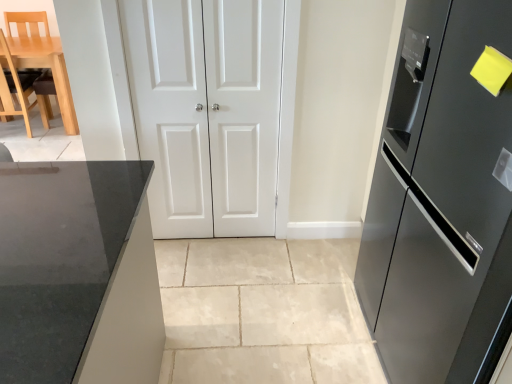
Question: Which direction should I rotate to look at white glossy door at center, which is counted as the 2th door, starting from the right, — up or down?

Choices:
 (A) up
 (B) down

Answer: (A)

Question: From the image's perspective, is white glossy door at center, which is counted as the first door, starting from the left, beneath satin black refrigerator at right?

Choices:
 (A) no
 (B) yes

Answer: (A)

Question: Does white glossy door at center, which is counted as the 2th door, starting from the right, have a greater height compared to satin black refrigerator at right?

Choices:
 (A) yes
 (B) no

Answer: (B)

Question: From the image's perspective, is white glossy door at center, which is counted as the 2th door, starting from the right, on satin black refrigerator at right?

Choices:
 (A) yes
 (B) no

Answer: (A)

Question: Are white glossy door at center, which is counted as the first door, starting from the left, and satin black refrigerator at right beside each other?

Choices:
 (A) no
 (B) yes

Answer: (A)

Question: Is white glossy door at center, which is counted as the first door, starting from the left, at the left side of satin black refrigerator at right?

Choices:
 (A) yes
 (B) no

Answer: (A)

Question: Does white glossy door at center, which is counted as the first door, starting from the left, have a larger size compared to satin black refrigerator at right?

Choices:
 (A) yes
 (B) no

Answer: (B)

Question: Does light wood/leather chair at left lie in front of satin black refrigerator at right?

Choices:
 (A) yes
 (B) no

Answer: (B)

Question: Does light wood/leather chair at left have a smaller size compared to satin black refrigerator at right?

Choices:
 (A) no
 (B) yes

Answer: (B)

Question: Is light wood/leather chair at left completely or partially outside of satin black refrigerator at right?

Choices:
 (A) no
 (B) yes

Answer: (B)

Question: Is satin black refrigerator at right a part of light wood/leather chair at left?

Choices:
 (A) yes
 (B) no

Answer: (B)

Question: Can you confirm if light wood/leather chair at left is bigger than satin black refrigerator at right?

Choices:
 (A) no
 (B) yes

Answer: (A)

Question: Is light wood/leather chair at left aimed at satin black refrigerator at right?

Choices:
 (A) yes
 (B) no

Answer: (B)

Question: Does white glossy door at center, which is counted as the first door, starting from the left, have a lesser height compared to white matte door at center, which is the second door in left-to-right order?

Choices:
 (A) yes
 (B) no

Answer: (B)